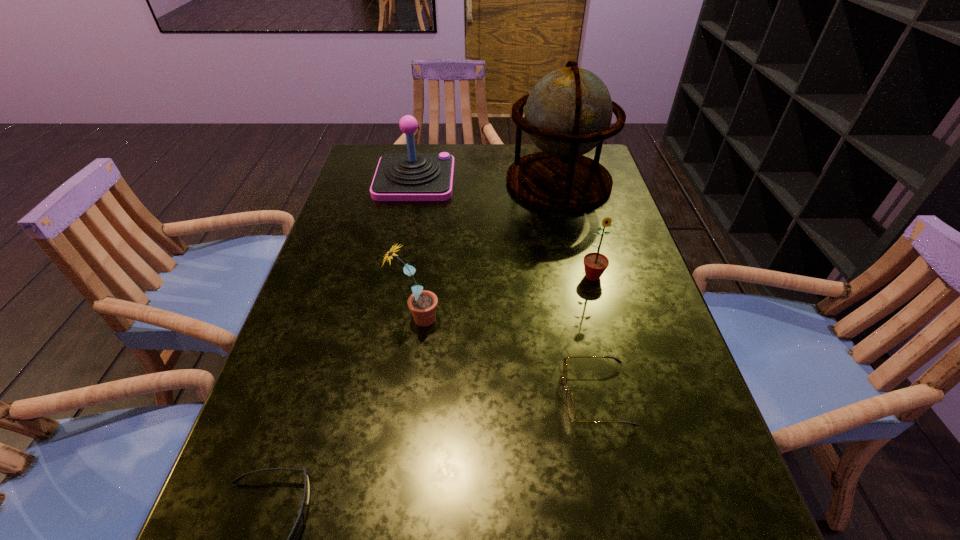
Identify the location of vacant space located 0.310m on the flower of the left sunflower. (588, 319).

Image resolution: width=960 pixels, height=540 pixels. In order to click on vacant space located on the face of the third farthest object in this screenshot , I will do `click(599, 301)`.

This screenshot has height=540, width=960. Find the location of `vacant point located 0.390m on the lenses of the taller sunglasses`. vacant point located 0.390m on the lenses of the taller sunglasses is located at coordinates tap(347, 396).

Find the location of `vacant space located 0.280m on the lenses of the taller sunglasses`. vacant space located 0.280m on the lenses of the taller sunglasses is located at coordinates (407, 396).

Locate an element on the screen. The width and height of the screenshot is (960, 540). vacant region located 0.100m on the lenses of the taller sunglasses is located at coordinates (508, 396).

In order to click on globe situated at the far edge in this screenshot , I will do `click(568, 113)`.

Identify the location of joystick that is at the far edge. This screenshot has width=960, height=540. (411, 176).

Locate an element on the screen. object at the left edge is located at coordinates (411, 176).

Locate an element on the screen. This screenshot has width=960, height=540. globe located at the right edge is located at coordinates (568, 113).

You are a GUI agent. You are given a task and a screenshot of the screen. Output one action in this format:
    pyautogui.click(x=<x>, y=<y>)
    Task: Click on the sunflower that is at the right edge
    This screenshot has width=960, height=540.
    Given the screenshot: What is the action you would take?
    595,264